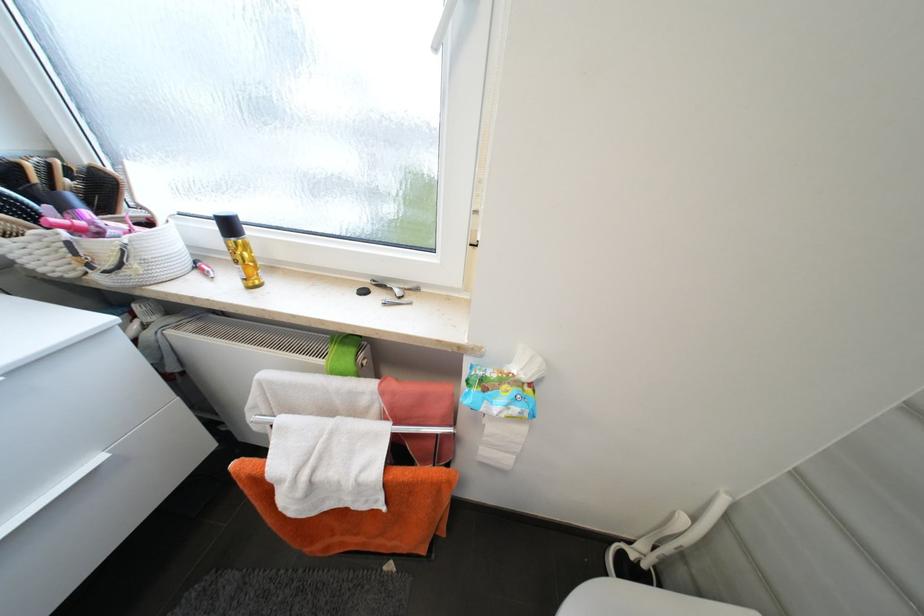
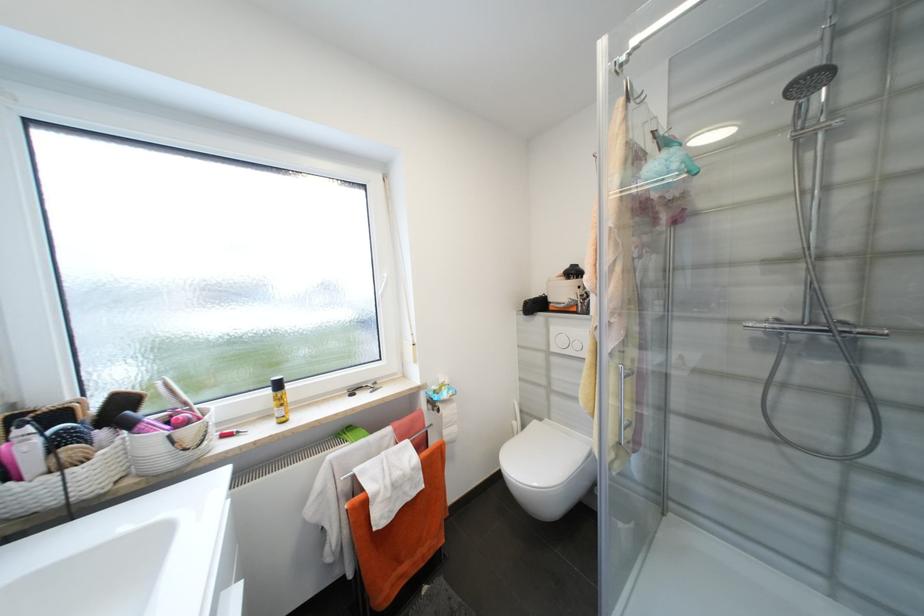
In the second image, find the point that corresponds to (x=235, y=228) in the first image.

(284, 386)